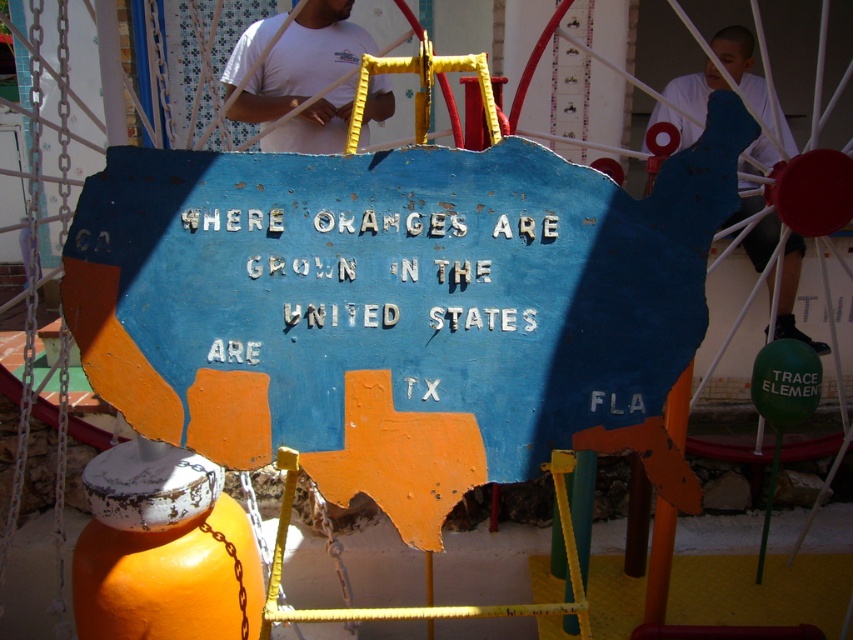
You are a GUI agent. You are given a task and a screenshot of the screen. Output one action in this format:
    pyautogui.click(x=<x>, y=<y>)
    Task: Click on the white painted letters at center
    
    Given the screenshot: What is the action you would take?
    pyautogui.click(x=363, y=269)

Can you confirm if white painted letters at center is bigger than white cotton shirt at upper center?

Incorrect, white painted letters at center is not larger than white cotton shirt at upper center.

The width and height of the screenshot is (853, 640). What do you see at coordinates (363, 269) in the screenshot? I see `white painted letters at center` at bounding box center [363, 269].

Find the location of a particular element. Image resolution: width=853 pixels, height=640 pixels. white painted letters at center is located at coordinates (363, 269).

Does white cotton shirt at upper center come in front of white matte shirt at upper center?

No, white cotton shirt at upper center is further to the viewer.

Who is higher up, white cotton shirt at upper center or white matte shirt at upper center?

white cotton shirt at upper center is above.

Find the location of a particular element. white cotton shirt at upper center is located at coordinates click(x=303, y=60).

Who is more forward, (x=245, y=243) or (x=747, y=216)?

Point (x=245, y=243) is in front.

The width and height of the screenshot is (853, 640). What are the coordinates of `white painted letters at center` in the screenshot? It's located at pyautogui.click(x=363, y=269).

The height and width of the screenshot is (640, 853). Describe the element at coordinates (363, 269) in the screenshot. I see `white painted letters at center` at that location.

The image size is (853, 640). What are the coordinates of `white painted letters at center` in the screenshot? It's located at (363, 269).